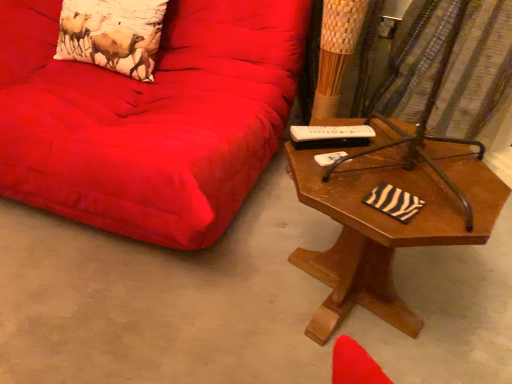
The height and width of the screenshot is (384, 512). I want to click on vacant space to the left of brown wooden table at right, so click(x=201, y=292).